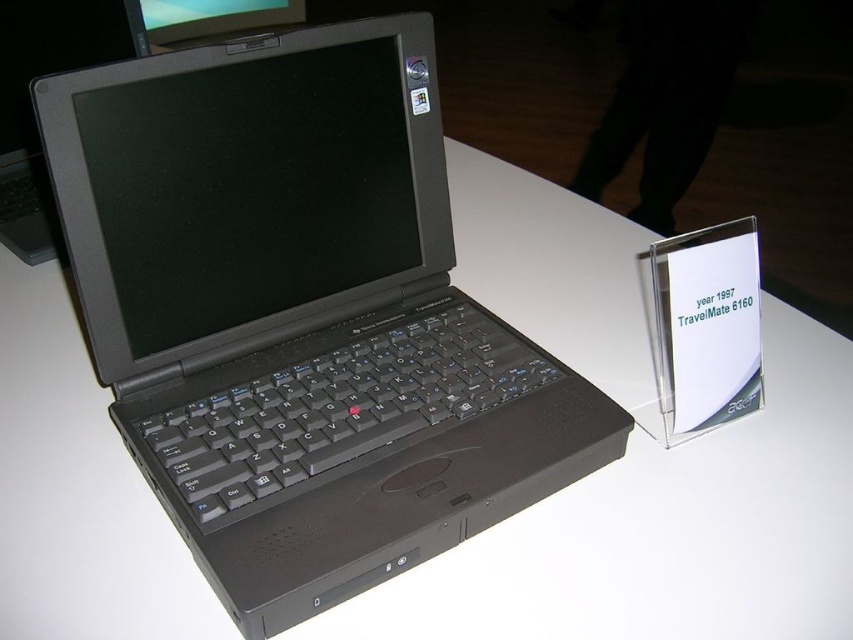
Is matte black laptop at center further to camera compared to black matte laptop at center?

That is False.

Is matte black laptop at center to the left of black matte laptop at center from the viewer's perspective?

No, matte black laptop at center is not to the left of black matte laptop at center.

Find the location of a particular element. Image resolution: width=853 pixels, height=640 pixels. matte black laptop at center is located at coordinates (300, 314).

At what (x,y) coordinates should I click in order to perform the action: click on matte black laptop at center. Please return your answer as a coordinate pair (x, y). Looking at the image, I should click on (300, 314).